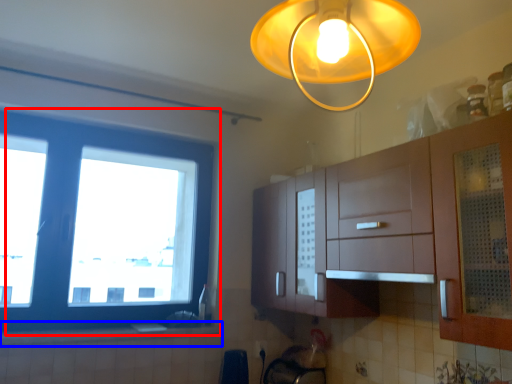
Question: Which point is further to the camera, window (highlighted by a red box) or counter top (highlighted by a blue box)?

Choices:
 (A) window
 (B) counter top

Answer: (A)